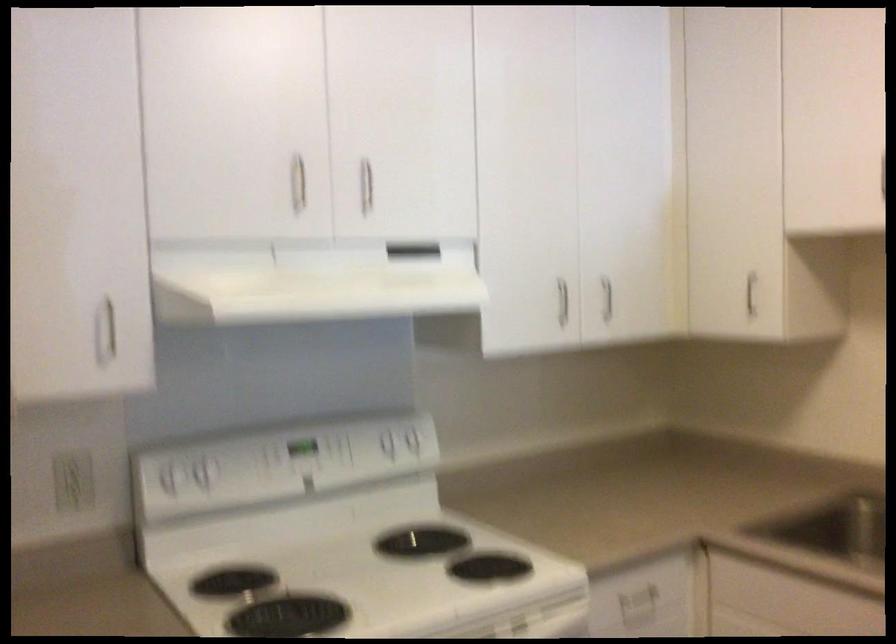
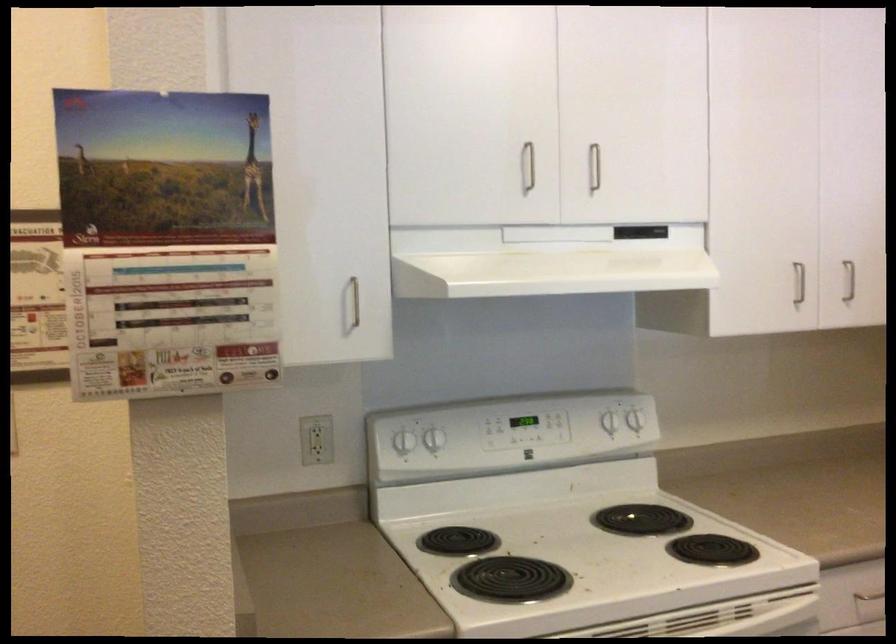
Find the pixel in the second image that matches (x=297, y=189) in the first image.

(528, 166)